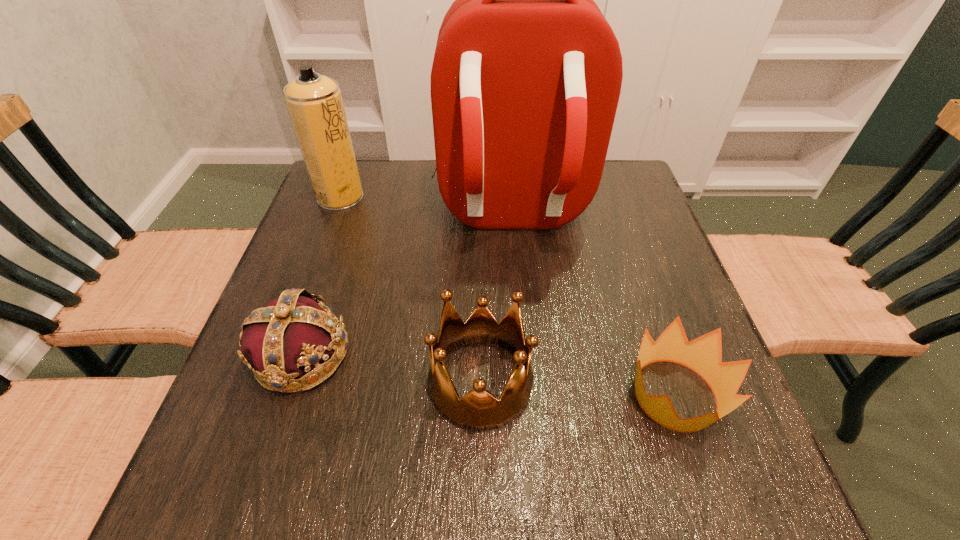
The height and width of the screenshot is (540, 960). What are the coordinates of `backpack` in the screenshot? It's located at (526, 78).

Locate an element on the screen. aerosol can is located at coordinates (314, 101).

At what (x,y) coordinates should I click in order to perform the action: click on the tallest crown. Please return your answer as a coordinate pair (x, y). The height and width of the screenshot is (540, 960). Looking at the image, I should click on (478, 410).

Find the location of a particular element. the third tallest object is located at coordinates (478, 410).

The width and height of the screenshot is (960, 540). I want to click on the second shortest crown, so click(290, 335).

Locate an element on the screen. the leftmost crown is located at coordinates (290, 335).

This screenshot has height=540, width=960. I want to click on the shortest object, so click(x=703, y=355).

I want to click on the rightmost crown, so 703,355.

I want to click on blank area located 0.130m on the strap side of the tallest object, so click(x=517, y=306).

Find the location of `free spot located on the back of the aerosol can`. free spot located on the back of the aerosol can is located at coordinates (352, 165).